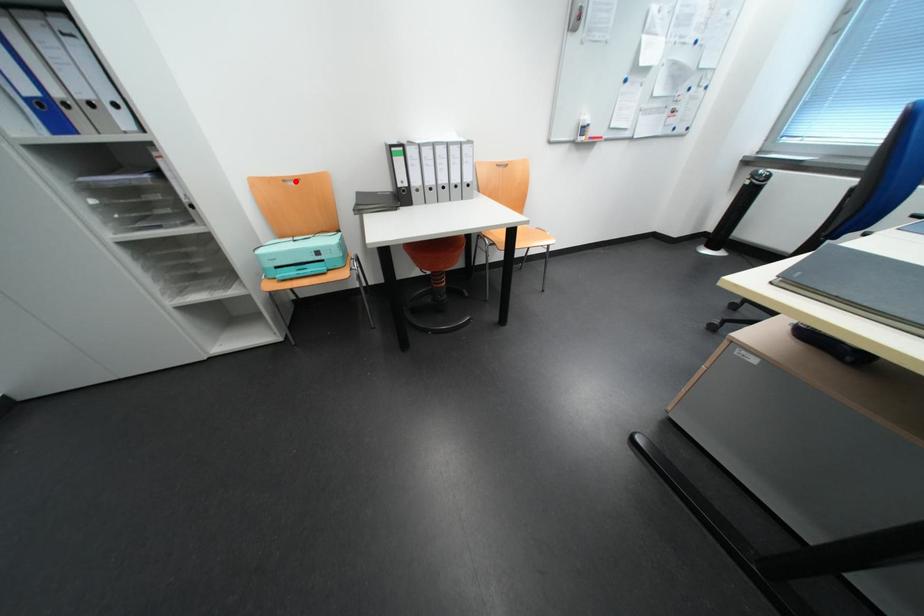
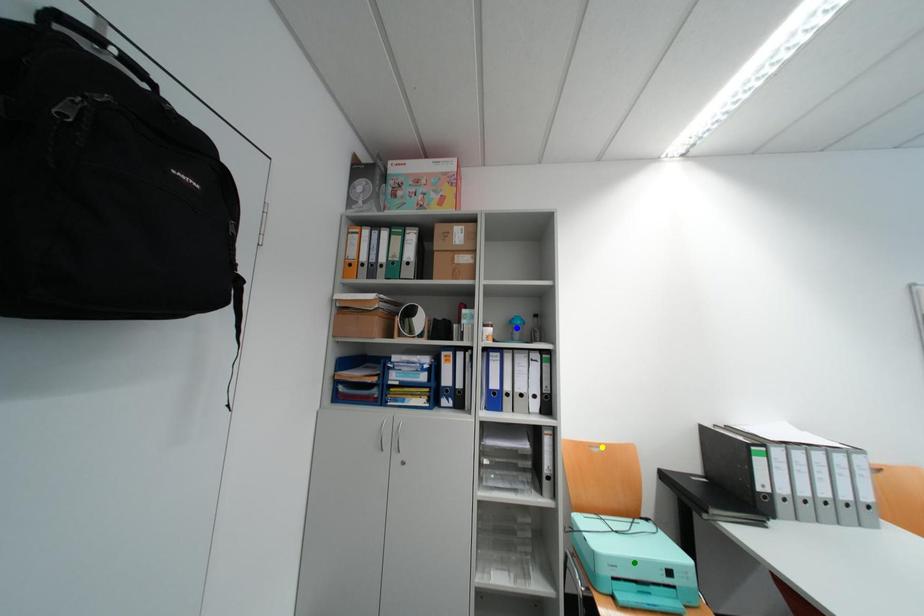
Question: I am providing you with two images of the same scene from different viewpoints. A red point is marked on the first image. You are given multiple points on the second image. Which point in image 2 is actually the same real-world point as the red point in image 1?

Choices:
 (A) green point
 (B) blue point
 (C) yellow point

Answer: (C)